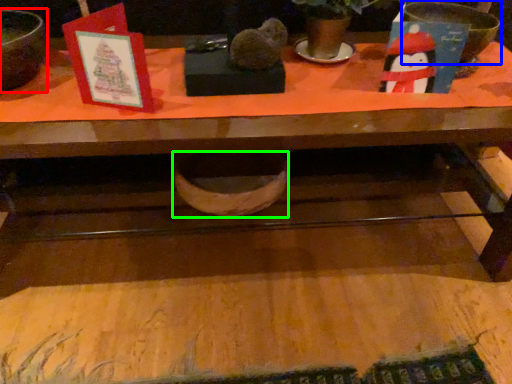
Question: Which object is positioned farthest from mixing bowl (highlighted by a red box)? Select from basin (highlighted by a blue box) and basin (highlighted by a green box).

Choices:
 (A) basin
 (B) basin

Answer: (A)